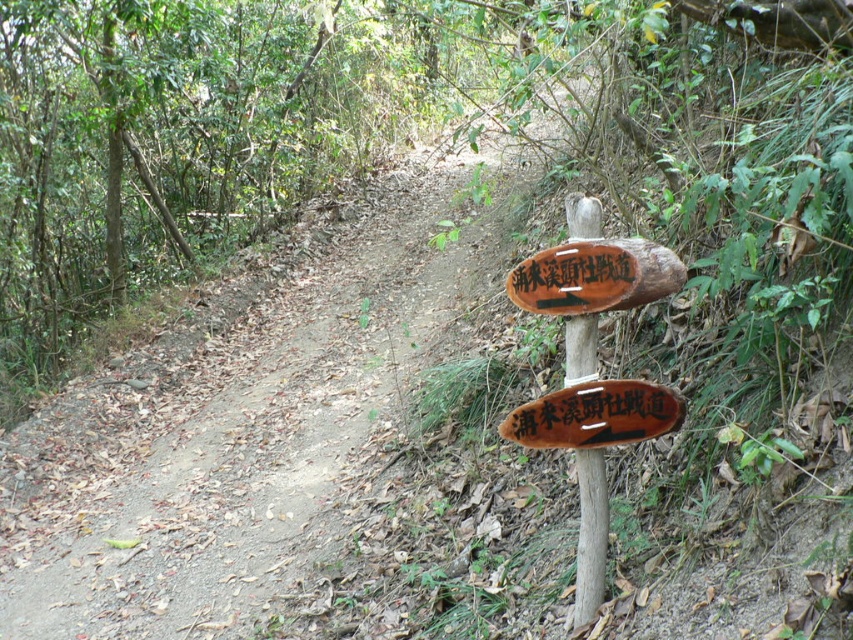
Question: Can you confirm if wooden sign at center-right is positioned above wooden sign at center?

Choices:
 (A) yes
 (B) no

Answer: (B)

Question: Which is nearer to the brown wooden sign at center?

Choices:
 (A) wooden signpost at center
 (B) wooden sign at center-right

Answer: (B)

Question: Which of these objects is positioned farthest from the wooden signpost at center?

Choices:
 (A) wooden sign at center
 (B) wooden sign at center-right
 (C) brown wooden sign at center

Answer: (A)

Question: Is brown dirt track at center above wooden signpost at center?

Choices:
 (A) yes
 (B) no

Answer: (A)

Question: Is brown dirt track at center above brown wooden sign at center?

Choices:
 (A) no
 (B) yes

Answer: (B)

Question: Among these points, which one is nearest to the camera?

Choices:
 (A) (387, 176)
 (B) (660, 404)
 (C) (601, 276)
 (D) (584, 316)

Answer: (C)